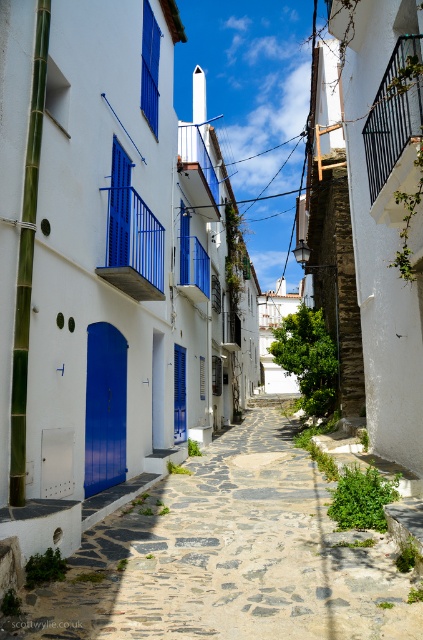
You are a photographer standing at the entrance of the street. You want to capture a photo that includes the black metal balcony at upper right. Based on the scene description, where should you position yourself to ensure the balcony is in the frame?

To include the black metal balcony at upper right in your photo, position yourself at the entrance of the street and aim your camera towards the upper right corner, as the balcony is located at coordinates point (392, 116).

You are a tourist standing in the middle of the narrow street. You want to take a photo that includes both the blue painted metal railing at center and the black metal balcony at upper right. Which object will appear larger in your photo?

The blue painted metal railing at center will appear larger in your photo because it is bigger than the black metal balcony at upper right.

You are a tourist standing at the entrance of the street, and you want to take a photo that includes both the stone paved path at center and the black metal balcony at upper right. Which object should you position closer to the front of your photo frame?

You should position the stone paved path at center closer to the front of your photo frame because it is closer to the viewer than the black metal balcony at upper right.